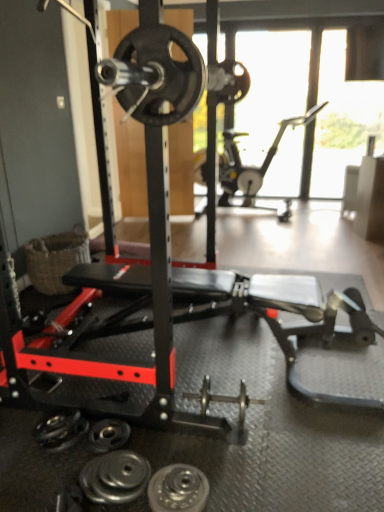
Find the location of `empty space that is ontop of silver metallic weight plate at lower center, the 1th wheel in the right-to-left sequence (from a real-world perspective)`. empty space that is ontop of silver metallic weight plate at lower center, the 1th wheel in the right-to-left sequence (from a real-world perspective) is located at coordinates (175, 488).